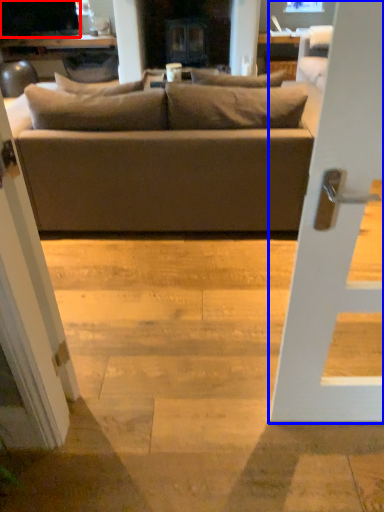
Question: Which object is further to the camera taking this photo, dark (highlighted by a red box) or door (highlighted by a blue box)?

Choices:
 (A) dark
 (B) door

Answer: (A)